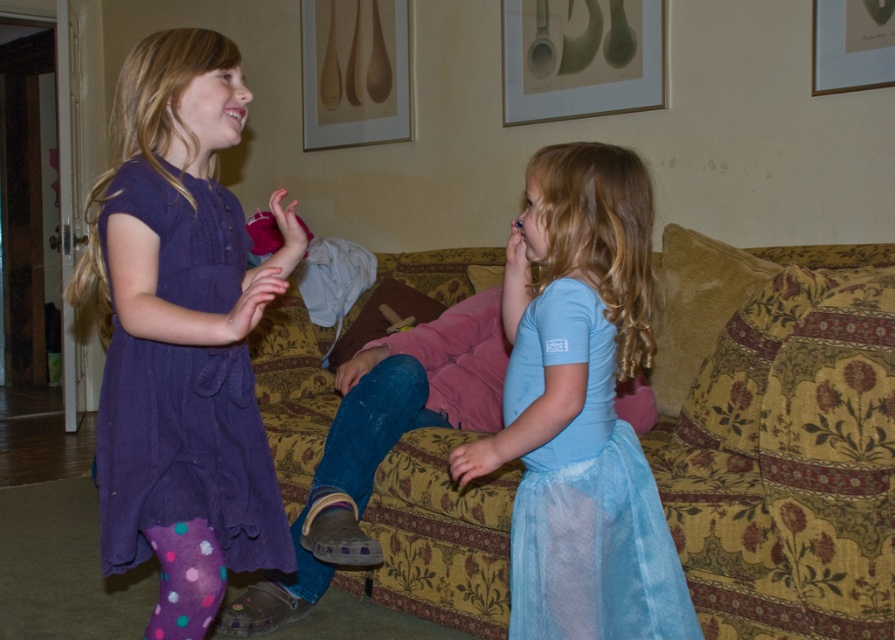
Question: Which of the following is the farthest from the observer?

Choices:
 (A) wooden spoons at upper center
 (B) light blue sheer fabric dress at lower right
 (C) purple cotton dress at left
 (D) gold/metallic picture frame at upper right

Answer: (A)

Question: Which point is closer to the camera?

Choices:
 (A) light gray paper at upper center
 (B) gold/metallic picture frame at upper right

Answer: (B)

Question: Estimate the real-world distances between objects in this image. Which object is farther from the floral-patterned fabric couch at center?

Choices:
 (A) purple polka dot sock at lower left
 (B) light gray paper at upper center

Answer: (B)

Question: Can you confirm if purple cotton dress at left is thinner than light blue sheer fabric dress at lower right?

Choices:
 (A) no
 (B) yes

Answer: (B)

Question: Does wooden spoons at upper center have a greater width compared to gold/metallic picture frame at upper right?

Choices:
 (A) no
 (B) yes

Answer: (B)

Question: Does purple polka dot sock at lower left appear under gold/metallic picture frame at upper right?

Choices:
 (A) yes
 (B) no

Answer: (A)